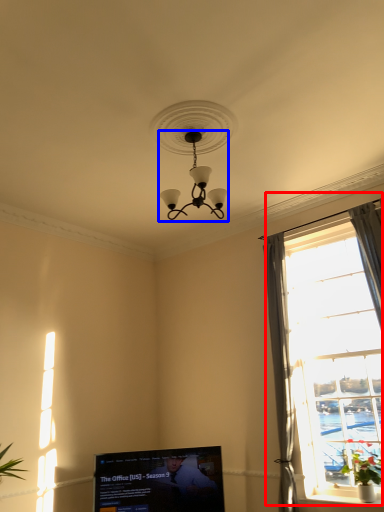
Question: Which object is closer to the camera taking this photo, window (highlighted by a red box) or lamp (highlighted by a blue box)?

Choices:
 (A) window
 (B) lamp

Answer: (B)